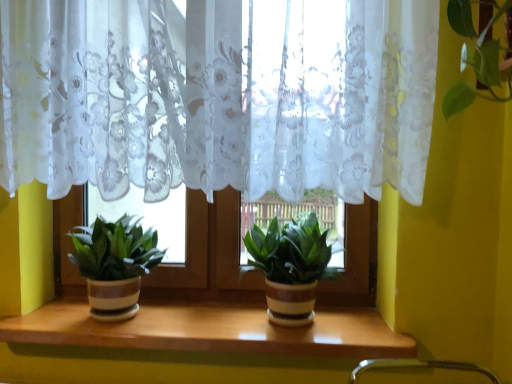
Where is `empty space that is to the right of green matte plant pot at left, which is the second houseplant in right-to-left order`? The height and width of the screenshot is (384, 512). empty space that is to the right of green matte plant pot at left, which is the second houseplant in right-to-left order is located at coordinates (194, 318).